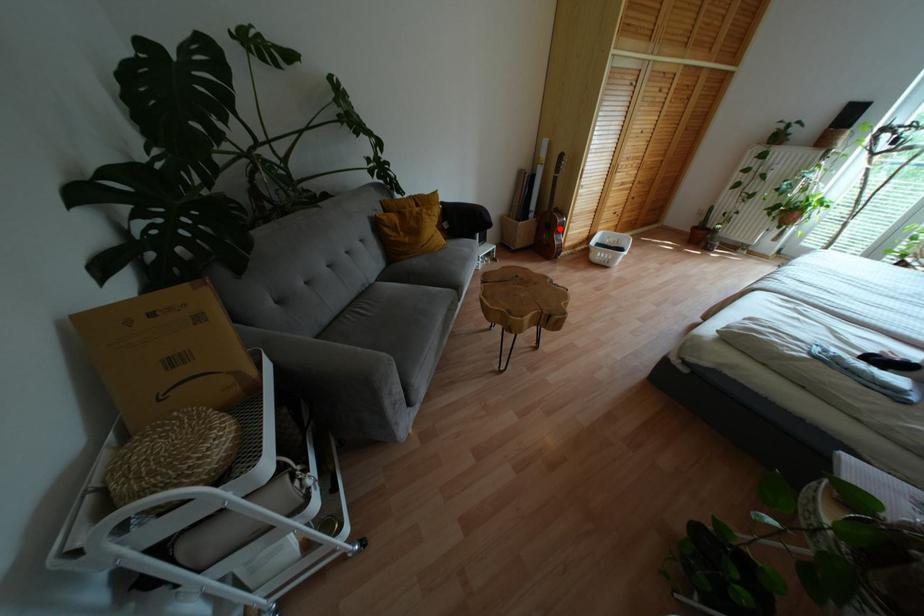
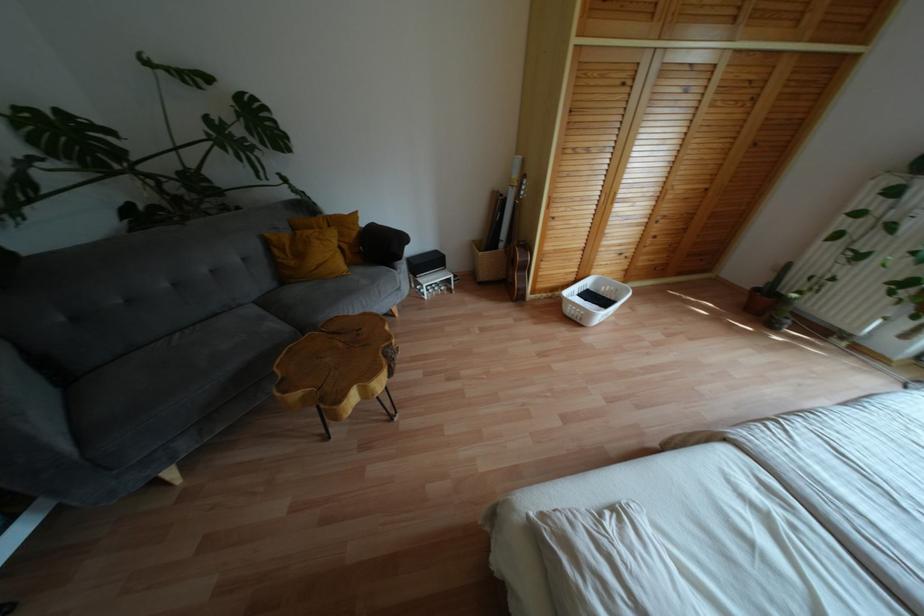
Locate, in the second image, the point that corresponds to the highlighted location in the first image.

(525, 267)